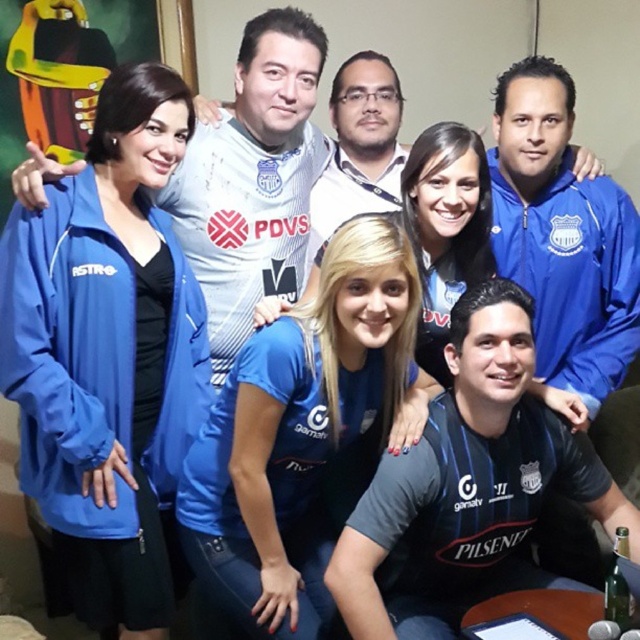
Question: Which of the following is the farthest from the observer?

Choices:
 (A) blue jersey at center
 (B) blue fabric jacket at left
 (C) blue fabric jacket at upper right
 (D) dark gray jersey at lower center

Answer: (C)

Question: Which object is closer to the camera taking this photo?

Choices:
 (A) matte white jersey at upper center
 (B) blue fabric jacket at left

Answer: (B)

Question: Which object is farther from the camera taking this photo?

Choices:
 (A) dark gray jersey at lower center
 (B) matte white jersey at upper center
 (C) blue fabric jacket at left
 (D) blue jersey at center

Answer: (B)

Question: Does dark gray jersey at lower center lie behind blue fabric jacket at upper right?

Choices:
 (A) no
 (B) yes

Answer: (A)

Question: Does blue jersey at center appear under matte white jersey at upper center?

Choices:
 (A) yes
 (B) no

Answer: (A)

Question: Can you confirm if blue fabric jacket at left is bigger than dark gray jersey at lower center?

Choices:
 (A) no
 (B) yes

Answer: (A)